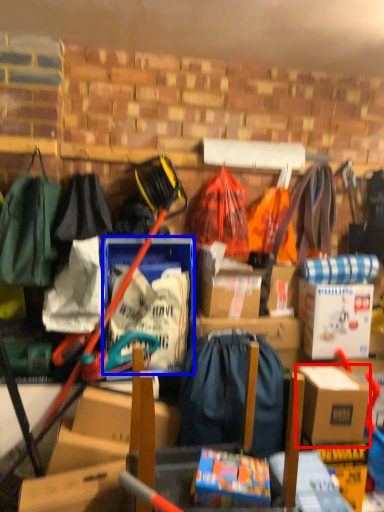
Question: Which of the following is the closest to the observer, box (highlighted by a red box) or storage box (highlighted by a blue box)?

Choices:
 (A) box
 (B) storage box

Answer: (A)